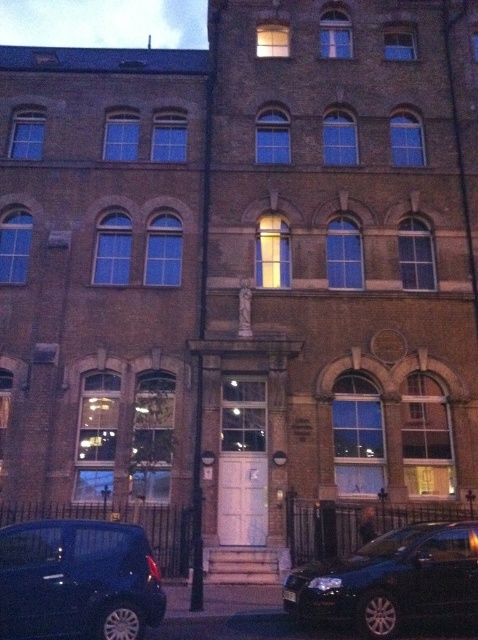
Who is lower down, shiny blue car at lower left or black metallic car at lower right?

black metallic car at lower right

Image resolution: width=478 pixels, height=640 pixels. What do you see at coordinates (77, 580) in the screenshot?
I see `shiny blue car at lower left` at bounding box center [77, 580].

Locate an element on the screen. This screenshot has height=640, width=478. shiny blue car at lower left is located at coordinates (77, 580).